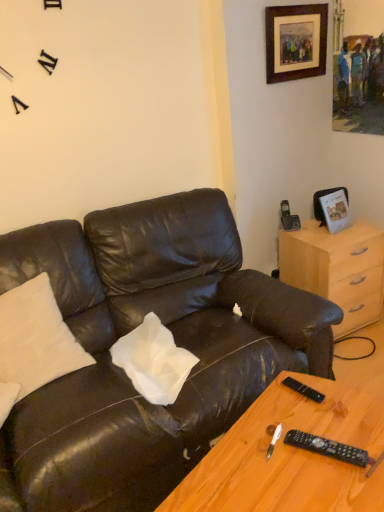
This screenshot has width=384, height=512. I want to click on vacant space to the left of black plastic remote at lower right, which is the second remote from top to bottom, so click(x=266, y=462).